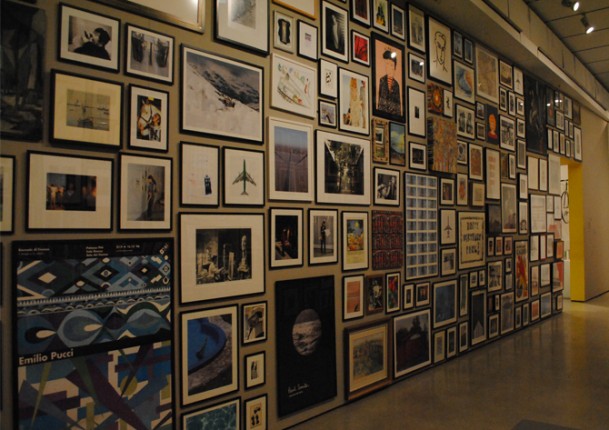
Where is `doorway`? The width and height of the screenshot is (609, 430). doorway is located at coordinates [566, 226].